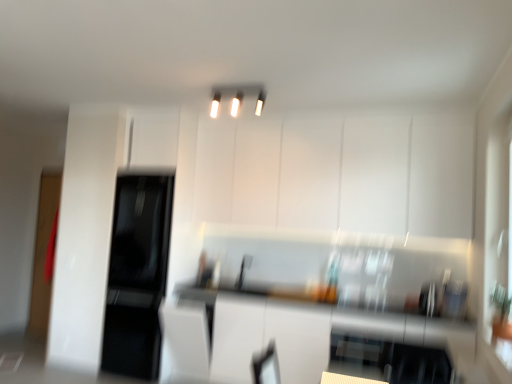
Locate an element on the screen. The image size is (512, 384). white glossy cabinet at upper center is located at coordinates (357, 174).

Identify the location of white glossy light fixture at upper center. The image size is (512, 384). pos(238,97).

What do you see at coordinates (238, 97) in the screenshot? The width and height of the screenshot is (512, 384). I see `white glossy light fixture at upper center` at bounding box center [238, 97].

The image size is (512, 384). What do you see at coordinates (308, 339) in the screenshot?
I see `white glossy countertop at center` at bounding box center [308, 339].

You are a GUI agent. You are given a task and a screenshot of the screen. Output one action in this format:
    pyautogui.click(x=<x>, y=<y>)
    Task: Click on the black glossy refrigerator at left
    The height and width of the screenshot is (384, 512).
    Given the screenshot: What is the action you would take?
    pyautogui.click(x=137, y=273)

The width and height of the screenshot is (512, 384). I want to click on cabinetry behind the white glossy countertop at center, so [x=357, y=174].

Is white glossy countertop at center positioned far away from white glossy cabinet at upper center?

Indeed, white glossy countertop at center is not near white glossy cabinet at upper center.

From the picture: Considering the relative sizes of white glossy countertop at center and white glossy cabinet at upper center in the image provided, is white glossy countertop at center wider than white glossy cabinet at upper center?

Yes, white glossy countertop at center is wider than white glossy cabinet at upper center.

Is point (277, 347) farther from camera compared to point (215, 86)?

Yes, it is behind point (215, 86).

Does white glossy countertop at center appear on the right side of white glossy light fixture at upper center?

Yes, white glossy countertop at center is to the right of white glossy light fixture at upper center.

Considering the relative sizes of white glossy countertop at center and white glossy light fixture at upper center in the image provided, is white glossy countertop at center thinner than white glossy light fixture at upper center?

In fact, white glossy countertop at center might be wider than white glossy light fixture at upper center.

In the scene shown: Is white glossy cabinet at upper center next to black glossy refrigerator at left and touching it?

No, white glossy cabinet at upper center is not next to black glossy refrigerator at left.

Looking at the image, does white glossy cabinet at upper center seem bigger or smaller compared to black glossy refrigerator at left?

In the image, white glossy cabinet at upper center appears to be larger than black glossy refrigerator at left.

Would you say white glossy cabinet at upper center is outside black glossy refrigerator at left?

Indeed, white glossy cabinet at upper center is completely outside black glossy refrigerator at left.

Is white glossy countertop at center to the right of black glossy refrigerator at left from the viewer's perspective?

Yes, white glossy countertop at center is to the right of black glossy refrigerator at left.

From the image's perspective, which is below, white glossy countertop at center or black glossy refrigerator at left?

From the image's view, white glossy countertop at center is below.

Is there a large distance between white glossy countertop at center and black glossy refrigerator at left?

white glossy countertop at center is far away from black glossy refrigerator at left.

Consider the image. Is white glossy light fixture at upper center far from white glossy countertop at center?

Absolutely, white glossy light fixture at upper center is distant from white glossy countertop at center.

Is white glossy light fixture at upper center positioned beyond the bounds of white glossy countertop at center?

Yes, white glossy light fixture at upper center is located beyond the bounds of white glossy countertop at center.

Considering the points (223, 94) and (167, 331), which point is behind, point (223, 94) or point (167, 331)?

The point (167, 331) is behind.

How many degrees apart are the facing directions of white glossy light fixture at upper center and white glossy countertop at center?

They differ by 0.172 degrees in their facing directions.

The height and width of the screenshot is (384, 512). In order to click on light fixture above the white glossy cabinet at upper center (from the image's perspective) in this screenshot , I will do `click(238, 97)`.

Is white glossy light fixture at upper center outside of white glossy cabinet at upper center?

Indeed, white glossy light fixture at upper center is completely outside white glossy cabinet at upper center.

From the picture: From the image's perspective, is white glossy light fixture at upper center located beneath white glossy cabinet at upper center?

No, from the image's perspective, white glossy light fixture at upper center is not beneath white glossy cabinet at upper center.

How many degrees apart are the facing directions of white glossy light fixture at upper center and white glossy cabinet at upper center?

They differ by 0.271 degrees in their facing directions.

Can you confirm if white glossy cabinet at upper center is smaller than white glossy countertop at center?

Indeed, white glossy cabinet at upper center has a smaller size compared to white glossy countertop at center.

Is point (310, 126) less distant than point (224, 355)?

No, (310, 126) is further to viewer.

Looking at their sizes, would you say white glossy cabinet at upper center is wider or thinner than white glossy countertop at center?

Clearly, white glossy cabinet at upper center has less width compared to white glossy countertop at center.

From a real-world perspective, between white glossy cabinet at upper center and white glossy countertop at center, who is vertically lower?

From a 3D spatial view, white glossy countertop at center is below.

The height and width of the screenshot is (384, 512). In order to click on cabinetry on the right of white glossy countertop at center in this screenshot , I will do `click(357, 174)`.

Locate an element on the screen. counter top below the white glossy light fixture at upper center (from a real-world perspective) is located at coordinates (308, 339).

From the image, which object appears to be nearer to white glossy light fixture at upper center, white glossy countertop at center or white glossy cabinet at upper center?

The object closer to white glossy light fixture at upper center is white glossy cabinet at upper center.

Estimate the real-world distances between objects in this image. Which object is closer to white glossy light fixture at upper center, black glossy refrigerator at left or white glossy cabinet at upper center?

The object closer to white glossy light fixture at upper center is white glossy cabinet at upper center.

Looking at this image, considering their positions, is white glossy countertop at center positioned closer to white glossy cabinet at upper center than white glossy light fixture at upper center?

white glossy light fixture at upper center lies closer to white glossy cabinet at upper center than the other object.

Estimate the real-world distances between objects in this image. Which object is closer to white glossy cabinet at upper center, black glossy refrigerator at left or white glossy light fixture at upper center?

white glossy light fixture at upper center is positioned closer to the anchor white glossy cabinet at upper center.

From the image, which object appears to be farther from white glossy cabinet at upper center, black glossy refrigerator at left or white glossy countertop at center?

black glossy refrigerator at left is further to white glossy cabinet at upper center.

Based on their spatial positions, is white glossy countertop at center or white glossy cabinet at upper center further from black glossy refrigerator at left?

Based on the image, white glossy cabinet at upper center appears to be further to black glossy refrigerator at left.

Looking at the image, which one is located closer to white glossy light fixture at upper center, white glossy countertop at center or black glossy refrigerator at left?

white glossy countertop at center lies closer to white glossy light fixture at upper center than the other object.

From the image, which object appears to be nearer to white glossy countertop at center, white glossy light fixture at upper center or white glossy cabinet at upper center?

white glossy cabinet at upper center is closer to white glossy countertop at center.

I want to click on appliance between white glossy light fixture at upper center and white glossy countertop at center vertically, so click(137, 273).

Find the location of a particular element. light fixture located between black glossy refrigerator at left and white glossy cabinet at upper center in the left-right direction is located at coordinates (238, 97).

This screenshot has width=512, height=384. I want to click on counter top between black glossy refrigerator at left and white glossy cabinet at upper center in the horizontal direction, so click(x=308, y=339).

At what (x,y) coordinates should I click in order to perform the action: click on cabinetry that lies between white glossy light fixture at upper center and white glossy countertop at center from top to bottom. Please return your answer as a coordinate pair (x, y). This screenshot has width=512, height=384. Looking at the image, I should click on (357, 174).